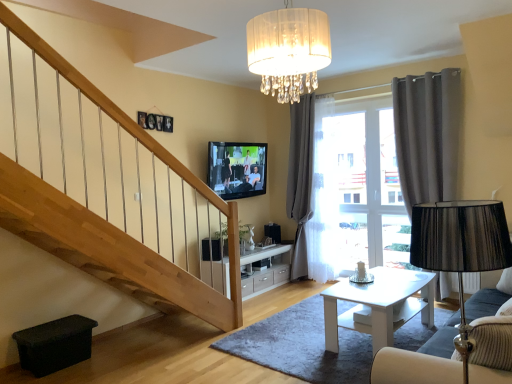
Question: Can you confirm if flat screen tv at upper center is wider than white glossy coffee table at center?

Choices:
 (A) yes
 (B) no

Answer: (B)

Question: Does flat screen tv at upper center have a greater height compared to white glossy coffee table at center?

Choices:
 (A) no
 (B) yes

Answer: (B)

Question: Is flat screen tv at upper center not inside white glossy coffee table at center?

Choices:
 (A) yes
 (B) no

Answer: (A)

Question: Is the depth of flat screen tv at upper center greater than that of white glossy coffee table at center?

Choices:
 (A) no
 (B) yes

Answer: (B)

Question: Is white glossy coffee table at center surrounded by flat screen tv at upper center?

Choices:
 (A) yes
 (B) no

Answer: (B)

Question: Does flat screen tv at upper center appear on the left side of white glossy coffee table at center?

Choices:
 (A) no
 (B) yes

Answer: (B)

Question: Is velvet blue sofa at lower right to the left of flat screen tv at upper center from the viewer's perspective?

Choices:
 (A) no
 (B) yes

Answer: (A)

Question: From a real-world perspective, is velvet blue sofa at lower right over flat screen tv at upper center?

Choices:
 (A) no
 (B) yes

Answer: (A)

Question: Is velvet blue sofa at lower right surrounding flat screen tv at upper center?

Choices:
 (A) no
 (B) yes

Answer: (A)

Question: Can you confirm if velvet blue sofa at lower right is thinner than flat screen tv at upper center?

Choices:
 (A) no
 (B) yes

Answer: (A)

Question: From the image's perspective, is velvet blue sofa at lower right on flat screen tv at upper center?

Choices:
 (A) no
 (B) yes

Answer: (A)

Question: Can you confirm if velvet blue sofa at lower right is wider than flat screen tv at upper center?

Choices:
 (A) no
 (B) yes

Answer: (B)

Question: Is dark gray fabric curtain at right, which is counted as the 2th curtain, starting from the left, oriented towards flat screen tv at upper center?

Choices:
 (A) yes
 (B) no

Answer: (B)